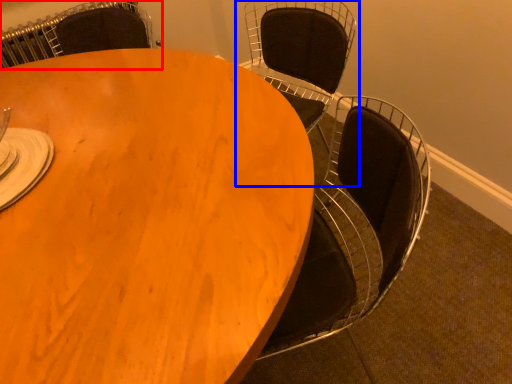
Question: Which object is closer to the camera taking this photo, chair (highlighted by a red box) or chair (highlighted by a blue box)?

Choices:
 (A) chair
 (B) chair

Answer: (B)